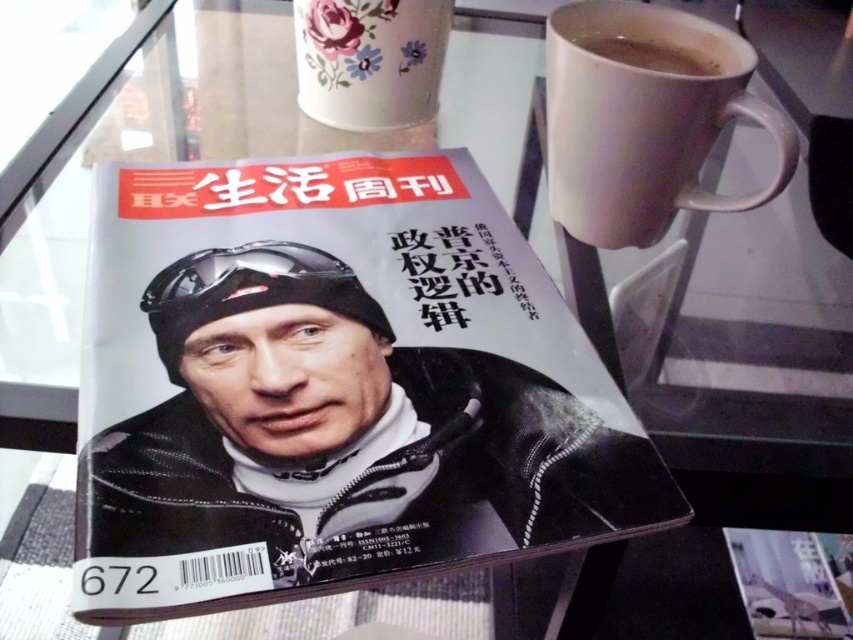
What do you see at coordinates (332, 388) in the screenshot? The width and height of the screenshot is (853, 640). I see `matte black magazine at center` at bounding box center [332, 388].

Describe the element at coordinates (332, 388) in the screenshot. I see `matte black magazine at center` at that location.

At what (x,y) coordinates should I click in order to perform the action: click on matte black magazine at center. Please return your answer as a coordinate pair (x, y). Looking at the image, I should click on (332, 388).

Is floral ceramic mug at upper center to the right of brown matte mug at upper right from the viewer's perspective?

No, floral ceramic mug at upper center is not to the right of brown matte mug at upper right.

Is floral ceramic mug at upper center thinner than brown matte mug at upper right?

No, floral ceramic mug at upper center is not thinner than brown matte mug at upper right.

What do you see at coordinates (370, 60) in the screenshot? The height and width of the screenshot is (640, 853). I see `floral ceramic mug at upper center` at bounding box center [370, 60].

This screenshot has height=640, width=853. In order to click on floral ceramic mug at upper center in this screenshot , I will do `click(370, 60)`.

Consider the image. Who is lower down, matte black magazine at center or floral ceramic mug at upper center?

matte black magazine at center is lower down.

Does matte black magazine at center lie behind floral ceramic mug at upper center?

No, matte black magazine at center is closer to the viewer.

Which is behind, point (619, 403) or point (392, 4)?

Positioned behind is point (392, 4).

This screenshot has width=853, height=640. I want to click on matte black magazine at center, so click(x=332, y=388).